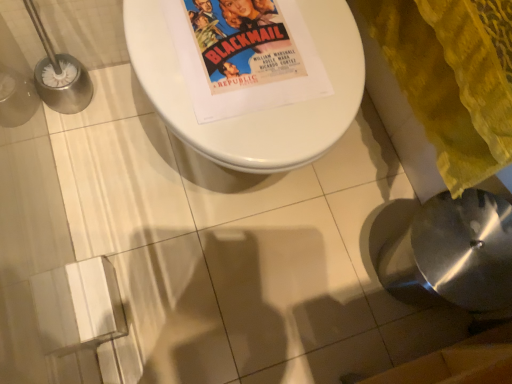
You are a GUI agent. You are given a task and a screenshot of the screen. Output one action in this format:
    pyautogui.click(x=<x>, y=<y>)
    Task: Click on the vacant space in front of satin silver sink at lower right
    
    Given the screenshot: What is the action you would take?
    pyautogui.click(x=347, y=332)